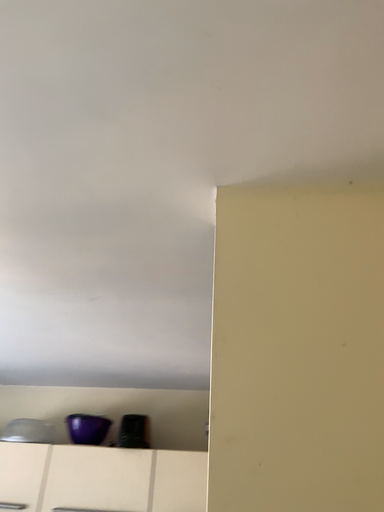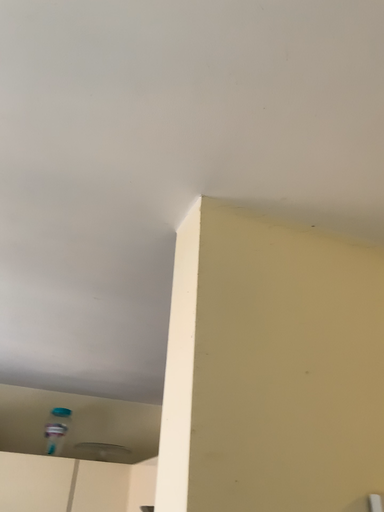
Question: How did the camera likely rotate when shooting the video?

Choices:
 (A) rotated right
 (B) rotated left

Answer: (A)